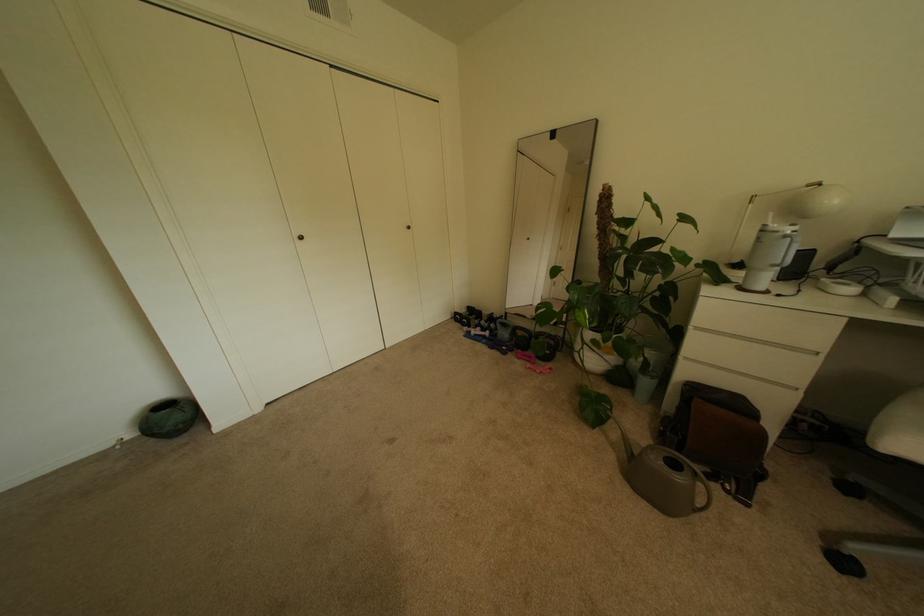
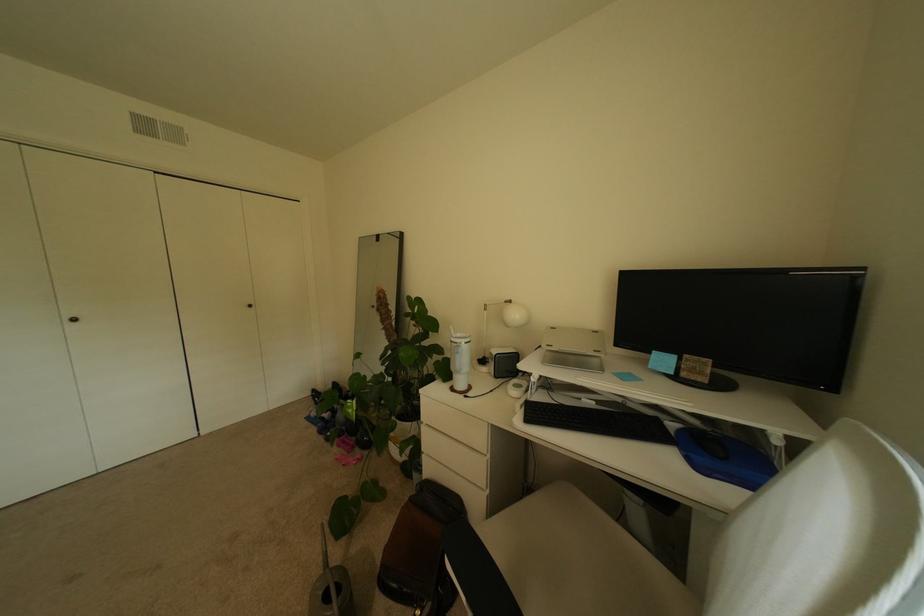
Question: In a continuous first-person perspective shot, in which direction is the camera moving?

Choices:
 (A) Left
 (B) Right
 (C) Forward
 (D) Backward

Answer: (B)